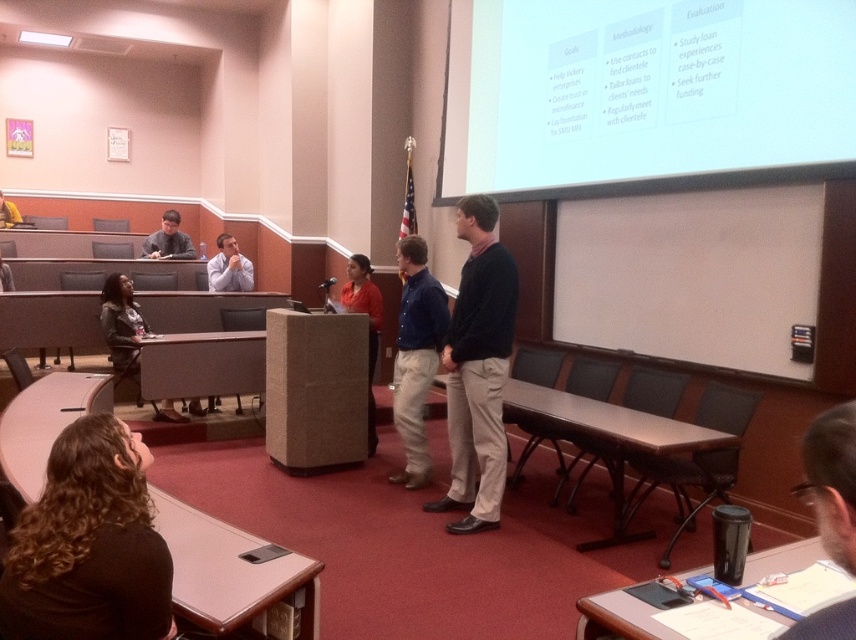
Is point (484, 225) positioned before point (852, 433)?

No, (484, 225) is further to viewer.

Between dark blue sweater at center and dark brown hair at lower right, which one appears on the left side from the viewer's perspective?

dark blue sweater at center is more to the left.

Is point (479, 332) farther from camera compared to point (840, 602)?

Yes, point (479, 332) is farther from viewer.

The image size is (856, 640). I want to click on dark blue sweater at center, so click(x=479, y=369).

Which is above, dark blue sweater at center or orange fabric shirt at center?

orange fabric shirt at center is above.

Identify the location of dark blue sweater at center. This screenshot has width=856, height=640. point(479,369).

The width and height of the screenshot is (856, 640). Find the location of `dark blue sweater at center`. dark blue sweater at center is located at coordinates (479, 369).

Is dark brown hair at lower right wider than blue denim shirt at center?

Incorrect, dark brown hair at lower right's width does not surpass blue denim shirt at center's.

Is point (851, 628) farther from camera compared to point (400, 266)?

No, (851, 628) is in front of (400, 266).

Which is behind, point (851, 612) or point (394, 378)?

The point (394, 378) is more distant.

At what (x,y) coordinates should I click in order to perform the action: click on dark brown hair at lower right. Please return your answer as a coordinate pair (x, y). Looking at the image, I should click on (831, 481).